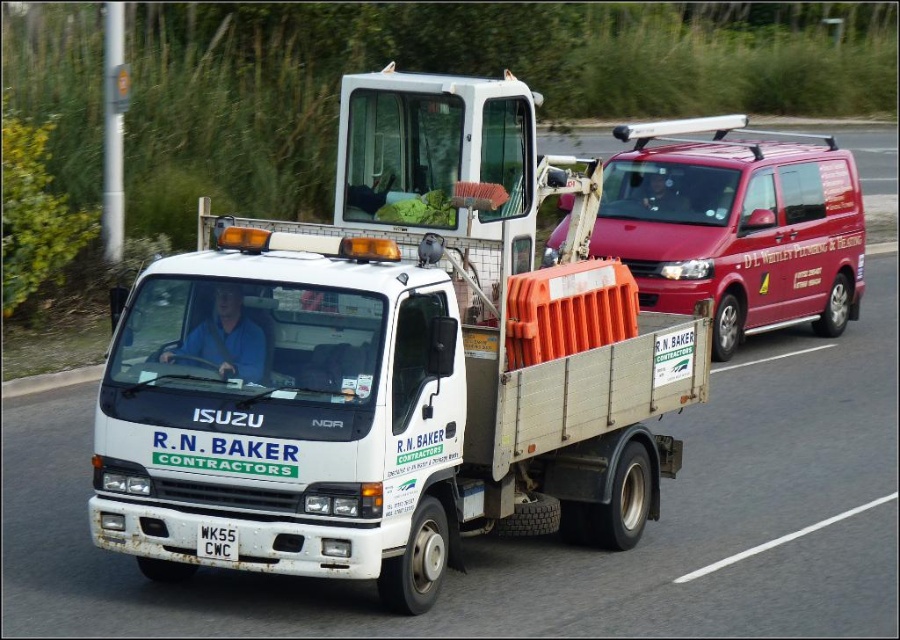
Question: Which object is closer to the camera taking this photo?

Choices:
 (A) white matte truck at center
 (B) metallic red van at right

Answer: (A)

Question: Can you confirm if metallic red van at right is thinner than white plastic license plate at lower center?

Choices:
 (A) no
 (B) yes

Answer: (A)

Question: Is metallic red van at right closer to camera compared to white plastic license plate at lower center?

Choices:
 (A) no
 (B) yes

Answer: (A)

Question: Considering the real-world distances, which object is closest to the white matte truck at center?

Choices:
 (A) white plastic license plate at lower center
 (B) metallic red van at right

Answer: (A)

Question: Is white matte truck at center thinner than white plastic license plate at lower center?

Choices:
 (A) yes
 (B) no

Answer: (B)

Question: Based on their relative distances, which object is nearer to the white matte truck at center?

Choices:
 (A) metallic red van at right
 (B) white plastic license plate at lower center

Answer: (B)